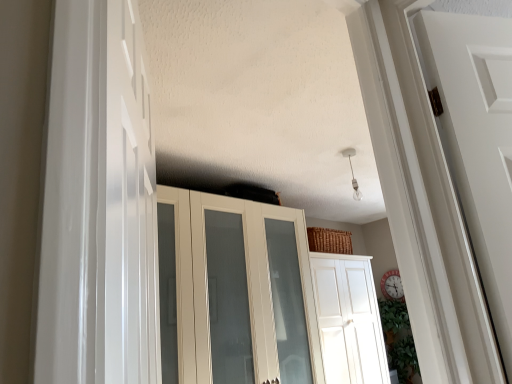
Question: In terms of height, does white glossy door at left, positioned as the second door in back-to-front order, look taller or shorter compared to white glossy door at center, the 1th door in the back-to-front sequence?

Choices:
 (A) short
 (B) tall

Answer: (A)

Question: Is white glossy door at left, the second door when ordered from bottom to top, to the left or to the right of white glossy door at center, acting as the second door starting from the left, in the image?

Choices:
 (A) left
 (B) right

Answer: (A)

Question: Estimate the real-world distances between objects in this image. Which object is closer to the white glossy cupboard at center?

Choices:
 (A) white glossy door at left, which is counted as the 1th door, starting from the front
 (B) white glossy door at center, the 2th door positioned from the front

Answer: (B)

Question: Which is nearer to the white glossy door at left, the second door when ordered from bottom to top?

Choices:
 (A) white glossy door at center, the 2th door positioned from the front
 (B) white glossy cupboard at center

Answer: (B)